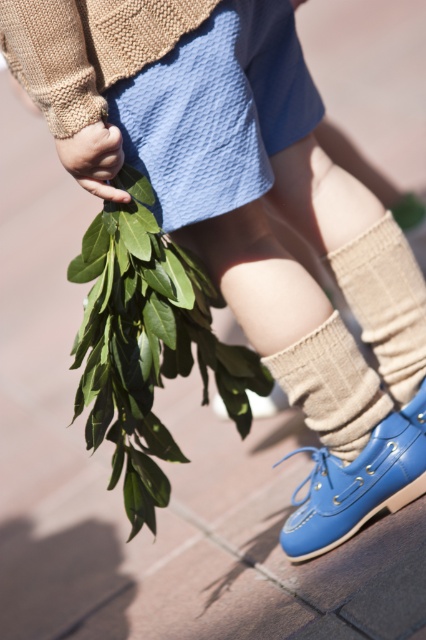
Question: Which of these objects is positioned farthest from the green leafy branch at lower left?

Choices:
 (A) blue leather shoe at lower right
 (B) knit beige sock at lower center
 (C) beige knitted sock at lower center

Answer: (B)

Question: Is blue leather shoe at lower right further to the viewer compared to beige knitted sock at lower center?

Choices:
 (A) no
 (B) yes

Answer: (B)

Question: From the image, what is the correct spatial relationship of green leafy branch at lower left in relation to beige knitted sock at lower center?

Choices:
 (A) above
 (B) below

Answer: (A)

Question: Considering the relative positions of green leafy branch at lower left and blue leather shoe at lower right in the image provided, where is green leafy branch at lower left located with respect to blue leather shoe at lower right?

Choices:
 (A) right
 (B) left

Answer: (B)

Question: Which is farther from the green leafy branch at lower left?

Choices:
 (A) beige knitted sock at lower center
 (B) blue leather shoe at lower right
 (C) knit beige sock at lower center

Answer: (C)

Question: Which point is farther to the camera?

Choices:
 (A) beige knitted sock at lower center
 (B) blue leather shoe at lower right
 (C) knit beige sock at lower center
 (D) green leafy branch at lower left

Answer: (C)